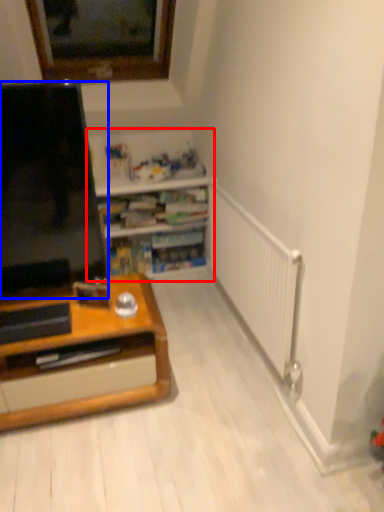
Question: Which object is further to the camera taking this photo, shelf (highlighted by a red box) or screen (highlighted by a blue box)?

Choices:
 (A) shelf
 (B) screen

Answer: (A)